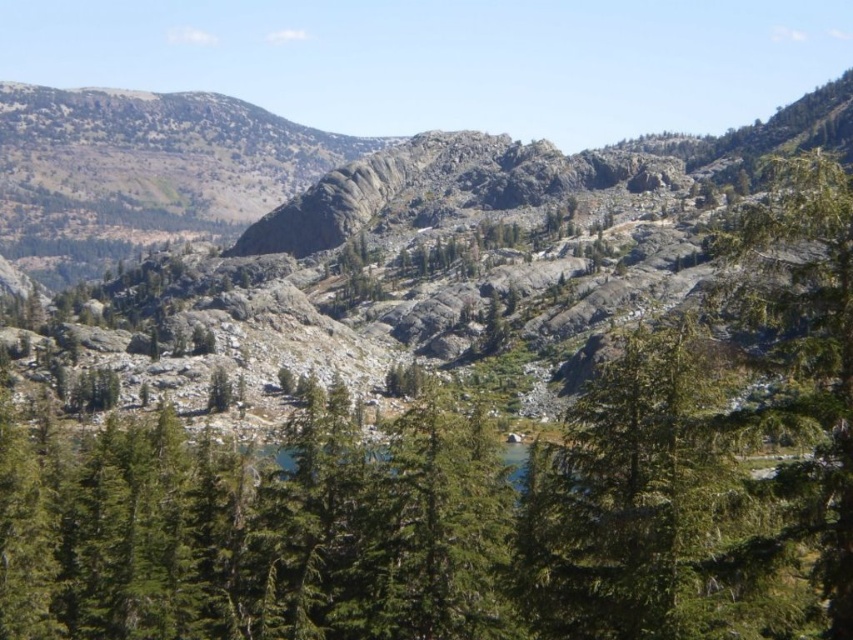
Consider the image. You are a hiker planning to take a photo of the gray rocky mountain at center and the green textured tree at right. Which object should you focus on first if you want both to be in clear view?

The gray rocky mountain at center is positioned over the green textured tree at right, so you should focus on the gray rocky mountain at center first to ensure both are in clear view.

In the scene shown: You are a hiker planning to reach the summit of the gray rocky mountain at center. Based on the image, can you determine the exact coordinates of the mountain to ensure you navigate correctly?

The gray rocky mountain at center is located at coordinates point (312,173).